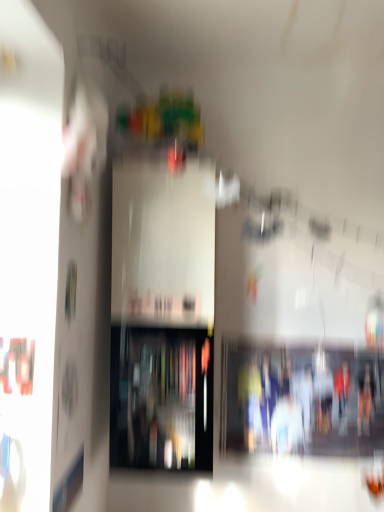
What is the approximate height of matte plastic shelf at center, which is the 1th shelf from right to left?

It is 22.25 inches.

Locate an element on the screen. The image size is (384, 512). matte plastic shelf at center, which appears as the 2th shelf when viewed from the left is located at coordinates (301, 400).

What do you see at coordinates (301, 400) in the screenshot? Image resolution: width=384 pixels, height=512 pixels. I see `matte plastic shelf at center, which is the 1th shelf from right to left` at bounding box center [301, 400].

From the picture: How much space does matte plastic shelf at center, which appears as the 2th shelf when viewed from the left, occupy horizontally?

The width of matte plastic shelf at center, which appears as the 2th shelf when viewed from the left, is 2.28 centimeters.

This screenshot has width=384, height=512. Find the location of `transparent glass shelf at center, which is counted as the 2th shelf, starting from the right`. transparent glass shelf at center, which is counted as the 2th shelf, starting from the right is located at coordinates (161, 398).

Image resolution: width=384 pixels, height=512 pixels. Describe the element at coordinates (161, 398) in the screenshot. I see `transparent glass shelf at center, placed as the 1th shelf when sorted from left to right` at that location.

Locate an element on the screen. This screenshot has width=384, height=512. matte plastic shelf at center, which is the 1th shelf from right to left is located at coordinates (301, 400).

Can you confirm if transparent glass shelf at center, which is counted as the 2th shelf, starting from the right, is positioned to the left of matte plastic shelf at center, which appears as the 2th shelf when viewed from the left?

Result: Yes.

Which object is more forward, transparent glass shelf at center, placed as the 1th shelf when sorted from left to right, or matte plastic shelf at center, which is the 1th shelf from right to left?

transparent glass shelf at center, placed as the 1th shelf when sorted from left to right, is in front.

Considering the positions of points (143, 350) and (284, 376), is point (143, 350) farther from camera compared to point (284, 376)?

No, it is in front of (284, 376).

From the image's perspective, which is below, transparent glass shelf at center, which is counted as the 2th shelf, starting from the right, or matte plastic shelf at center, which is the 1th shelf from right to left?

From the image's view, matte plastic shelf at center, which is the 1th shelf from right to left, is below.

From a real-world perspective, is transparent glass shelf at center, which is counted as the 2th shelf, starting from the right, physically below matte plastic shelf at center, which appears as the 2th shelf when viewed from the left?

No, from a real-world perspective, transparent glass shelf at center, which is counted as the 2th shelf, starting from the right, is not below matte plastic shelf at center, which appears as the 2th shelf when viewed from the left.

Considering the relative sizes of transparent glass shelf at center, placed as the 1th shelf when sorted from left to right, and matte plastic shelf at center, which is the 1th shelf from right to left, in the image provided, is transparent glass shelf at center, placed as the 1th shelf when sorted from left to right, wider than matte plastic shelf at center, which is the 1th shelf from right to left,?

Indeed, transparent glass shelf at center, placed as the 1th shelf when sorted from left to right, has a greater width compared to matte plastic shelf at center, which is the 1th shelf from right to left.

From the picture: Is transparent glass shelf at center, which is counted as the 2th shelf, starting from the right, shorter than matte plastic shelf at center, which appears as the 2th shelf when viewed from the left?

No.

Looking at this image, which of these two, transparent glass shelf at center, placed as the 1th shelf when sorted from left to right, or matte plastic shelf at center, which is the 1th shelf from right to left, is bigger?

Bigger between the two is transparent glass shelf at center, placed as the 1th shelf when sorted from left to right.

Is matte plastic shelf at center, which appears as the 2th shelf when viewed from the left, located within transparent glass shelf at center, which is counted as the 2th shelf, starting from the right?

No, matte plastic shelf at center, which appears as the 2th shelf when viewed from the left, is not a part of transparent glass shelf at center, which is counted as the 2th shelf, starting from the right.

Is the surface of transparent glass shelf at center, which is counted as the 2th shelf, starting from the right, in direct contact with matte plastic shelf at center, which is the 1th shelf from right to left?

No, transparent glass shelf at center, which is counted as the 2th shelf, starting from the right, is not in contact with matte plastic shelf at center, which is the 1th shelf from right to left.

Is transparent glass shelf at center, placed as the 1th shelf when sorted from left to right, aimed at matte plastic shelf at center, which is the 1th shelf from right to left?

A: No, transparent glass shelf at center, placed as the 1th shelf when sorted from left to right, is not turned towards matte plastic shelf at center, which is the 1th shelf from right to left.

Can you tell me how much transparent glass shelf at center, placed as the 1th shelf when sorted from left to right, and matte plastic shelf at center, which is the 1th shelf from right to left, differ in facing direction?

The angular difference between transparent glass shelf at center, placed as the 1th shelf when sorted from left to right, and matte plastic shelf at center, which is the 1th shelf from right to left, is 2.14 degrees.

Locate an element on the screen. shelf positioned vertically above the matte plastic shelf at center, which appears as the 2th shelf when viewed from the left (from a real-world perspective) is located at coordinates (161, 398).

Based on their positions, is matte plastic shelf at center, which is the 1th shelf from right to left, located to the left or right of transparent glass shelf at center, which is counted as the 2th shelf, starting from the right?

Clearly, matte plastic shelf at center, which is the 1th shelf from right to left, is on the right of transparent glass shelf at center, which is counted as the 2th shelf, starting from the right, in the image.

Is matte plastic shelf at center, which is the 1th shelf from right to left, in front of or behind transparent glass shelf at center, placed as the 1th shelf when sorted from left to right, in the image?

matte plastic shelf at center, which is the 1th shelf from right to left, is positioned farther from the viewer than transparent glass shelf at center, placed as the 1th shelf when sorted from left to right.

Is point (346, 446) positioned before point (119, 354)?

No.

From the image's perspective, which one is positioned lower, matte plastic shelf at center, which appears as the 2th shelf when viewed from the left, or transparent glass shelf at center, which is counted as the 2th shelf, starting from the right?

matte plastic shelf at center, which appears as the 2th shelf when viewed from the left, is shown below in the image.

From a real-world perspective, between matte plastic shelf at center, which is the 1th shelf from right to left, and transparent glass shelf at center, placed as the 1th shelf when sorted from left to right, who is vertically lower?

From a 3D spatial view, matte plastic shelf at center, which is the 1th shelf from right to left, is below.

Considering the relative sizes of matte plastic shelf at center, which appears as the 2th shelf when viewed from the left, and transparent glass shelf at center, placed as the 1th shelf when sorted from left to right, in the image provided, is matte plastic shelf at center, which appears as the 2th shelf when viewed from the left, wider than transparent glass shelf at center, placed as the 1th shelf when sorted from left to right,?

Incorrect, the width of matte plastic shelf at center, which appears as the 2th shelf when viewed from the left, does not surpass that of transparent glass shelf at center, placed as the 1th shelf when sorted from left to right.

Is matte plastic shelf at center, which appears as the 2th shelf when viewed from the left, taller than transparent glass shelf at center, placed as the 1th shelf when sorted from left to right?

No.

Which of these two, matte plastic shelf at center, which is the 1th shelf from right to left, or transparent glass shelf at center, which is counted as the 2th shelf, starting from the right, is smaller?

Smaller between the two is matte plastic shelf at center, which is the 1th shelf from right to left.

Is matte plastic shelf at center, which is the 1th shelf from right to left, outside of transparent glass shelf at center, placed as the 1th shelf when sorted from left to right?

Yes, matte plastic shelf at center, which is the 1th shelf from right to left, is outside of transparent glass shelf at center, placed as the 1th shelf when sorted from left to right.

Is matte plastic shelf at center, which is the 1th shelf from right to left, not close to transparent glass shelf at center, which is counted as the 2th shelf, starting from the right?

matte plastic shelf at center, which is the 1th shelf from right to left, is near transparent glass shelf at center, which is counted as the 2th shelf, starting from the right, not far away.

Could you tell me if matte plastic shelf at center, which is the 1th shelf from right to left, is turned towards transparent glass shelf at center, placed as the 1th shelf when sorted from left to right?

No, matte plastic shelf at center, which is the 1th shelf from right to left, is not facing towards transparent glass shelf at center, placed as the 1th shelf when sorted from left to right.

How many degrees apart are the facing directions of matte plastic shelf at center, which is the 1th shelf from right to left, and transparent glass shelf at center, placed as the 1th shelf when sorted from left to right?

2.14 degrees.

Find the location of `shelf on the left of the matte plastic shelf at center, which appears as the 2th shelf when viewed from the left`. shelf on the left of the matte plastic shelf at center, which appears as the 2th shelf when viewed from the left is located at coordinates (161, 398).

You are a GUI agent. You are given a task and a screenshot of the screen. Output one action in this format:
    pyautogui.click(x=<x>, y=<y>)
    Task: Click on the shelf that appears behind the transparent glass shelf at center, which is counted as the 2th shelf, starting from the right
    This screenshot has width=384, height=512.
    Given the screenshot: What is the action you would take?
    pyautogui.click(x=301, y=400)

Where is `shelf located in front of the matte plastic shelf at center, which appears as the 2th shelf when viewed from the left`? This screenshot has height=512, width=384. shelf located in front of the matte plastic shelf at center, which appears as the 2th shelf when viewed from the left is located at coordinates (161, 398).